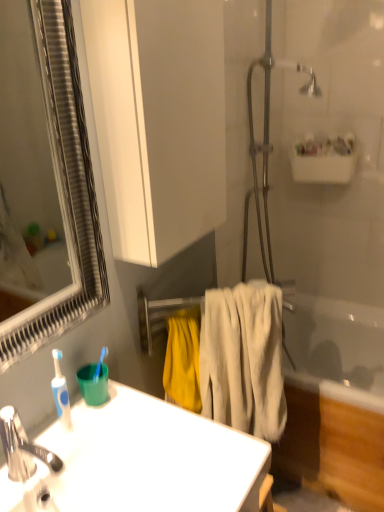
Image resolution: width=384 pixels, height=512 pixels. Find the location of `metallic silver towel rack at center`. metallic silver towel rack at center is located at coordinates (159, 316).

The height and width of the screenshot is (512, 384). What are the coordinates of `white fluffy towel at center` in the screenshot? It's located at (243, 359).

Identify the location of white matte cabinet at upper center. (158, 120).

Locate an element on the screen. polished chrome faucet at lower left is located at coordinates (22, 448).

The image size is (384, 512). What are the coordinates of `metallic silver towel rack at center` in the screenshot? It's located at (159, 316).

Who is taller, polished chrome faucet at lower left or white matte cabinet at upper center?

With more height is white matte cabinet at upper center.

Considering the relative sizes of polished chrome faucet at lower left and white matte cabinet at upper center in the image provided, is polished chrome faucet at lower left smaller than white matte cabinet at upper center?

Yes.

From the image's perspective, which is below, polished chrome faucet at lower left or white matte cabinet at upper center?

polished chrome faucet at lower left is shown below in the image.

From the picture: From a real-world perspective, which object stands above the other?

From a 3D spatial view, silver-framed mirror at left is above.

In the scene shown: From the image's perspective, which is below, silver-framed mirror at left or polished chrome faucet at lower left?

From the image's view, polished chrome faucet at lower left is below.

Is silver-framed mirror at left not within polished chrome faucet at lower left?

Yes, silver-framed mirror at left is located beyond the bounds of polished chrome faucet at lower left.

Based on their sizes in the image, would you say white glossy sink at lower left is bigger or smaller than white matte cabinet at upper center?

white glossy sink at lower left is smaller than white matte cabinet at upper center.

Can you confirm if white glossy sink at lower left is positioned to the left of white matte cabinet at upper center?

Yes.

Are white glossy sink at lower left and white matte cabinet at upper center far apart?

No, there isn't a large distance between white glossy sink at lower left and white matte cabinet at upper center.

Would you say white fluffy towel at center is inside or outside metallic silver towel rack at center?

The correct answer is: outside.

Is point (266, 318) closer to viewer compared to point (291, 285)?

That is True.

Between white fluffy towel at center and metallic silver towel rack at center, which one has larger width?

white fluffy towel at center.

Looking at this image, how many degrees apart are the facing directions of white fluffy towel at center and metallic silver towel rack at center?

9.8 degrees.

Which object is positioned more to the right, polished chrome faucet at lower left or white fluffy towel at center?

From the viewer's perspective, white fluffy towel at center appears more on the right side.

From the image's perspective, which one is positioned lower, polished chrome faucet at lower left or white fluffy towel at center?

From the image's view, white fluffy towel at center is below.

From a real-world perspective, which object stands above the other?

polished chrome faucet at lower left is physically above.

Is polished chrome faucet at lower left positioned behind white fluffy towel at center?

No, the depth of polished chrome faucet at lower left is less than that of white fluffy towel at center.

In the image, is silver-framed mirror at left on the left side or the right side of metallic silver towel rack at center?

silver-framed mirror at left is positioned on metallic silver towel rack at center's left side.

From the picture: How far apart are silver-framed mirror at left and metallic silver towel rack at center?

silver-framed mirror at left is 1.92 meters from metallic silver towel rack at center.

Looking at this image, considering the sizes of silver-framed mirror at left and metallic silver towel rack at center in the image, is silver-framed mirror at left taller or shorter than metallic silver towel rack at center?

In the image, silver-framed mirror at left appears to be taller than metallic silver towel rack at center.

Considering the relative sizes of silver-framed mirror at left and metallic silver towel rack at center in the image provided, is silver-framed mirror at left bigger than metallic silver towel rack at center?

Result: No, silver-framed mirror at left is not bigger than metallic silver towel rack at center.

How distant is metallic silver towel rack at center from polished chrome faucet at lower left?

metallic silver towel rack at center is 53.55 centimeters from polished chrome faucet at lower left.

From the image's perspective, does metallic silver towel rack at center appear higher than polished chrome faucet at lower left?

Yes, from the image's perspective, metallic silver towel rack at center is on top of polished chrome faucet at lower left.

Which is correct: metallic silver towel rack at center is inside polished chrome faucet at lower left, or outside of it?

metallic silver towel rack at center lies outside polished chrome faucet at lower left.

Can you tell me how much metallic silver towel rack at center and polished chrome faucet at lower left differ in facing direction?

metallic silver towel rack at center and polished chrome faucet at lower left are facing 39 degrees away from each other.

Where is `bathroom cabinet on the right of polished chrome faucet at lower left`? Image resolution: width=384 pixels, height=512 pixels. bathroom cabinet on the right of polished chrome faucet at lower left is located at coordinates (158, 120).

You are a GUI agent. You are given a task and a screenshot of the screen. Output one action in this format:
    pyautogui.click(x=<x>, y=<y>)
    Task: Click on the mirror that is in front of the polished chrome faucet at lower left
    The image size is (384, 512).
    Given the screenshot: What is the action you would take?
    pyautogui.click(x=22, y=149)

Estimate the real-world distances between objects in this image. Which object is closer to silver-framed mirror at left, metallic silver towel rack at center or white glossy sink at lower left?

metallic silver towel rack at center is closer to silver-framed mirror at left.

Looking at the image, which one is located closer to polished chrome faucet at lower left, silver-framed mirror at left or white glossy sink at lower left?

white glossy sink at lower left is closer to polished chrome faucet at lower left.

Which object lies nearer to the anchor point white glossy sink at lower left, polished chrome faucet at lower left or white matte cabinet at upper center?

Among the two, polished chrome faucet at lower left is located nearer to white glossy sink at lower left.

Looking at the image, which one is located closer to metallic silver towel rack at center, white glossy sink at lower left or white matte cabinet at upper center?

white glossy sink at lower left.

Which object lies further to the anchor point white fluffy towel at center, white matte cabinet at upper center or polished chrome faucet at lower left?

polished chrome faucet at lower left lies further to white fluffy towel at center than the other object.

Based on their spatial positions, is white matte cabinet at upper center or silver-framed mirror at left further from metallic silver towel rack at center?

silver-framed mirror at left is positioned further to the anchor metallic silver towel rack at center.

Looking at the image, which one is located further to polished chrome faucet at lower left, white fluffy towel at center or white glossy sink at lower left?

white fluffy towel at center lies further to polished chrome faucet at lower left than the other object.

In the scene shown: When comparing their distances from white fluffy towel at center, does white glossy sink at lower left or metallic silver towel rack at center seem closer?

metallic silver towel rack at center is positioned closer to the anchor white fluffy towel at center.

Identify the location of bath towel positioned between silver-framed mirror at left and metallic silver towel rack at center from near to far. (243, 359).

Where is `mirror between white matte cabinet at upper center and white fluffy towel at center in the vertical direction`? The width and height of the screenshot is (384, 512). mirror between white matte cabinet at upper center and white fluffy towel at center in the vertical direction is located at coordinates (22, 149).

Image resolution: width=384 pixels, height=512 pixels. Identify the location of balustrade between polished chrome faucet at lower left and white fluffy towel at center from left to right. (159, 316).

This screenshot has height=512, width=384. What are the coordinates of `bath towel between white glossy sink at lower left and metallic silver towel rack at center along the z-axis` in the screenshot? It's located at (243, 359).